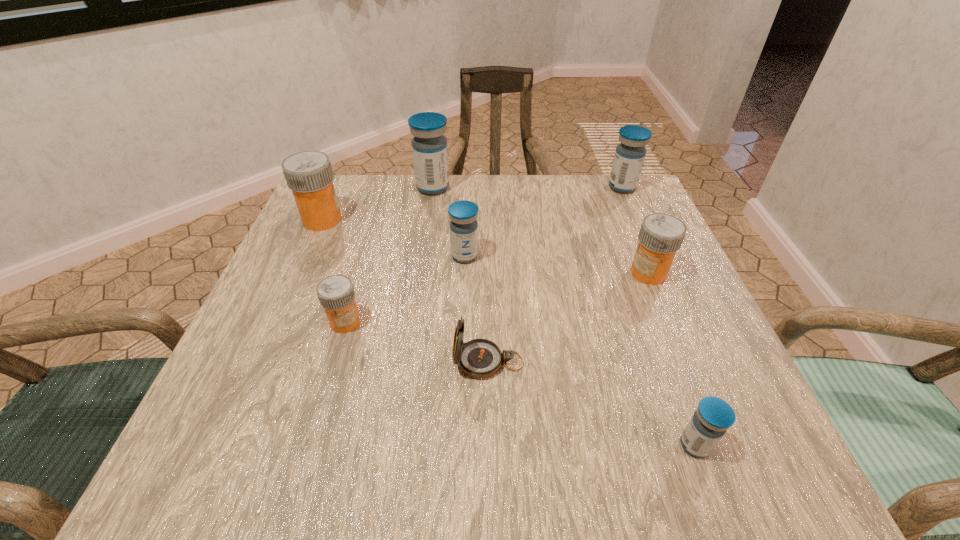
You are a GUI agent. You are given a task and a screenshot of the screen. Output one action in this format:
    pyautogui.click(x=<x>, y=<y>)
    Task: Click on the free spot between the seventh farthest object and the smallest blue medicine
    
    Given the screenshot: What is the action you would take?
    pyautogui.click(x=591, y=403)

Locate an element on the screen. The width and height of the screenshot is (960, 540). free area in between the leftmost blue medicine and the seventh farthest object is located at coordinates (461, 275).

This screenshot has width=960, height=540. I want to click on free space between the nearest medicine and the farthest orange medicine, so click(509, 333).

I want to click on vacant area between the fourth medicine from right to left and the sixth object from right to left, so click(448, 222).

Find the location of a particular element. This screenshot has width=960, height=540. unoccupied area between the second object from left to right and the third biggest blue medicine is located at coordinates (405, 289).

This screenshot has height=540, width=960. Find the location of `the closest object relative to the biggest orange medicine`. the closest object relative to the biggest orange medicine is located at coordinates (429, 147).

Locate which object ranks sixth in proximity to the leftmost blue medicine. Please provide its 2D coordinates. Your answer should be formatted as a tuple, i.e. [(x, y)], where the tuple contains the x and y coordinates of a point satisfying the conditions above.

[(479, 358)]

Identify which medicine is the third nearest to the fourth medicine from right to left. Please provide its 2D coordinates. Your answer should be formatted as a tuple, i.e. [(x, y)], where the tuple contains the x and y coordinates of a point satisfying the conditions above.

[(309, 174)]

Locate which medicine ranks fifth in proximity to the sixth nearest object. Please provide its 2D coordinates. Your answer should be formatted as a tuple, i.e. [(x, y)], where the tuple contains the x and y coordinates of a point satisfying the conditions above.

[(629, 157)]

Locate which blue medicine ranks third in proximity to the nearest object. Please provide its 2D coordinates. Your answer should be formatted as a tuple, i.e. [(x, y)], where the tuple contains the x and y coordinates of a point satisfying the conditions above.

[(429, 147)]